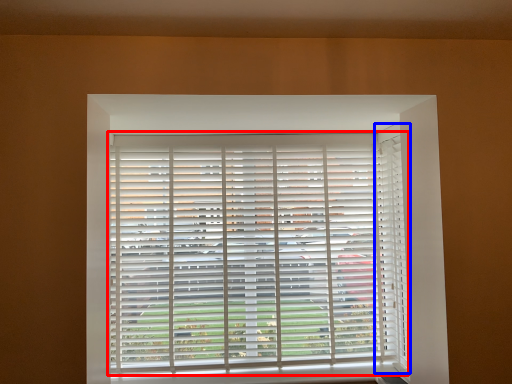
Question: Which point is further to the camera, window blind (highlighted by a red box) or curtain (highlighted by a blue box)?

Choices:
 (A) window blind
 (B) curtain

Answer: (A)